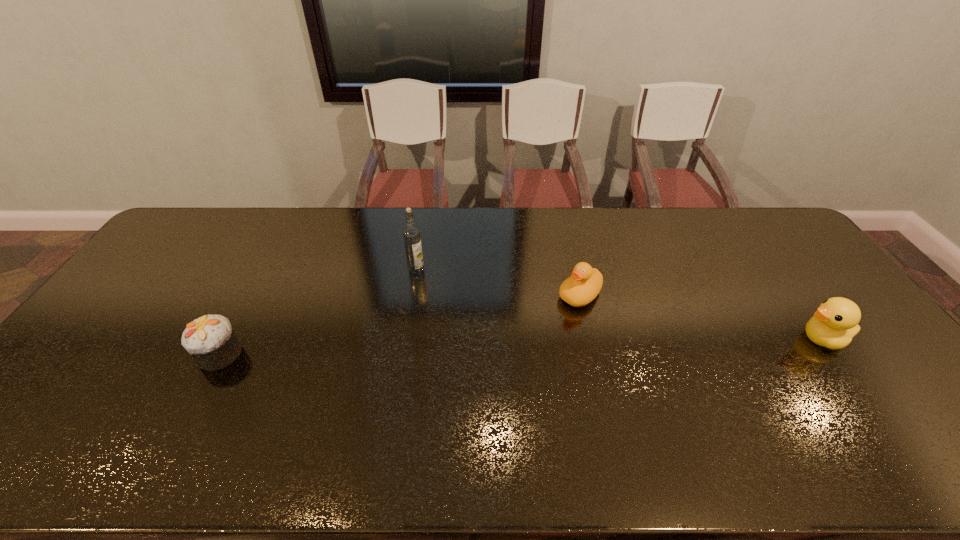
Locate an element on the screen. vacant space on the desktop that is between the leftmost object and the right duck and is positioned on the label of the farthest object is located at coordinates (447, 348).

Locate an element on the screen. This screenshot has height=540, width=960. free spot on the desktop that is between the cupcake and the rightmost object and is positioned on the face of the third object from left to right is located at coordinates (516, 346).